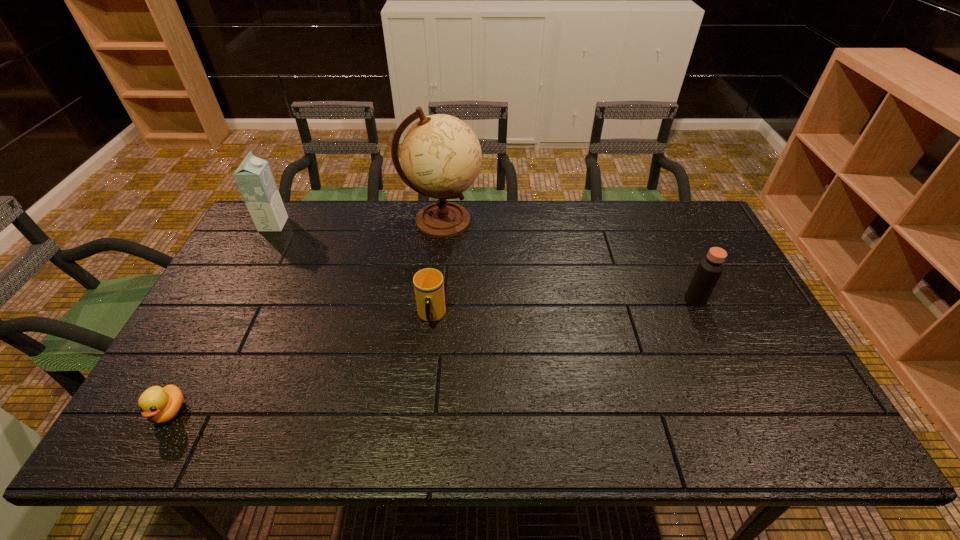
This screenshot has width=960, height=540. I want to click on vacant space that satisfies the following two spatial constraints: 1. on the surface of the tallest object; 2. on the back side of the vinegar, so click(x=434, y=299).

I want to click on free space that satisfies the following two spatial constraints: 1. on the front label of the second tallest object; 2. on the back side of the third shortest object, so click(233, 299).

In order to click on free space that satisfies the following two spatial constraints: 1. on the surface of the globe; 2. on the face of the duckling in this screenshot , I will do `click(422, 411)`.

Find the location of a particular element. Image resolution: width=960 pixels, height=540 pixels. blank area in the image that satisfies the following two spatial constraints: 1. on the surface of the tallest object; 2. on the side of the cup with the handle is located at coordinates (432, 316).